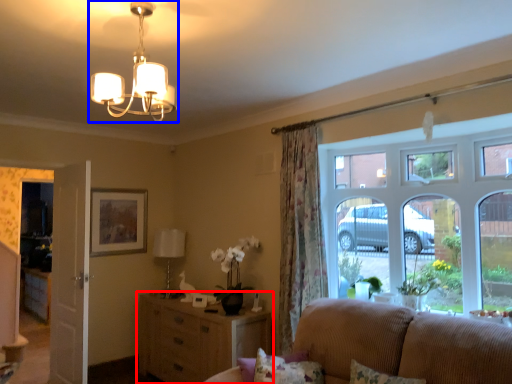
Question: Which object appears closest to the camera in this image, cabinetry (highlighted by a red box) or lamp (highlighted by a blue box)?

Choices:
 (A) cabinetry
 (B) lamp

Answer: (B)